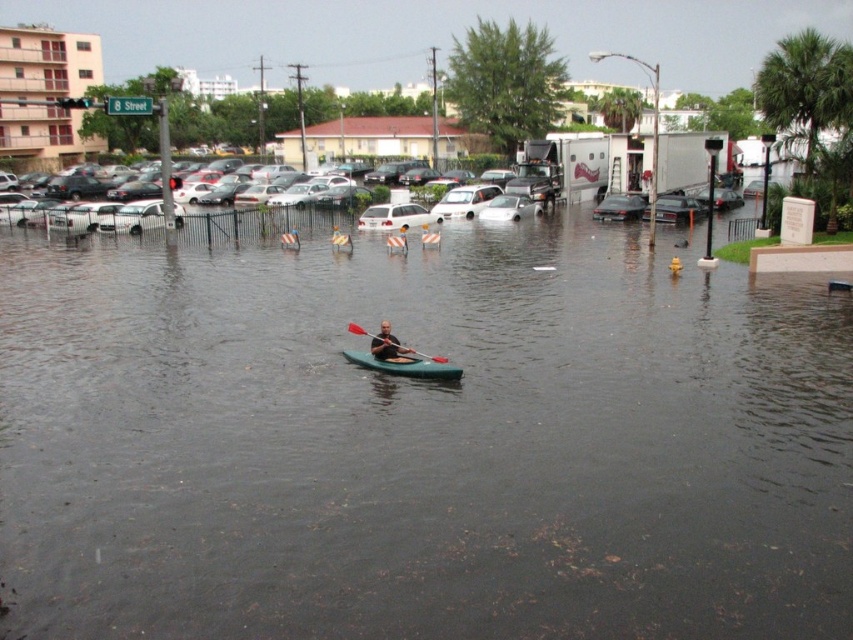
Question: Can you confirm if white matte car at center is bigger than shiny black sedan at center?

Choices:
 (A) no
 (B) yes

Answer: (B)

Question: Which point appears farthest from the camera in this image?

Choices:
 (A) (358, 332)
 (B) (427, 365)
 (C) (387, 330)
 (D) (596, 214)

Answer: (D)

Question: Can you confirm if green matte kayak at center is positioned to the right of white matte car at center?

Choices:
 (A) yes
 (B) no

Answer: (B)

Question: Is green matte kayak at center to the right of silver metallic sedan at center from the viewer's perspective?

Choices:
 (A) no
 (B) yes

Answer: (A)

Question: Estimate the real-world distances between objects in this image. Which object is closer to the green matte kayak at center?

Choices:
 (A) shiny black sedan at center
 (B) smooth green kayak at center
 (C) dark gray water at center
 (D) green matte paddle at center

Answer: (B)

Question: Which of the following is the farthest from the observer?

Choices:
 (A) (347, 323)
 (B) (494, 259)

Answer: (B)